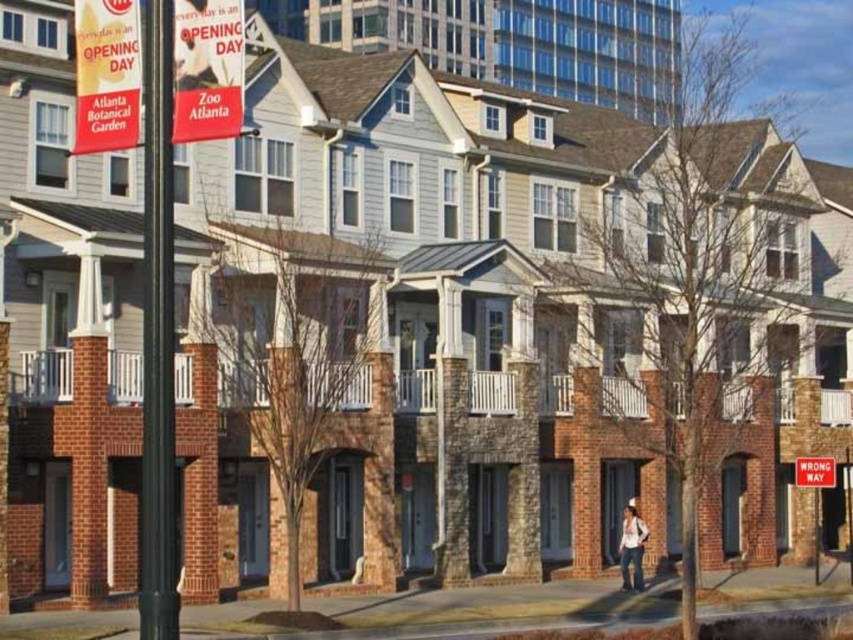
Question: Where is white cotton shirt at lower right located in relation to wrong way sign at lower right in the image?

Choices:
 (A) right
 (B) left

Answer: (B)

Question: Which point is closer to the camera?

Choices:
 (A) wrong way sign at lower right
 (B) white cotton shirt at lower right

Answer: (B)

Question: Is white cotton shirt at lower right above wrong way sign at lower right?

Choices:
 (A) no
 (B) yes

Answer: (A)

Question: Where is white cotton shirt at lower right located in relation to wrong way sign at lower right in the image?

Choices:
 (A) left
 (B) right

Answer: (A)